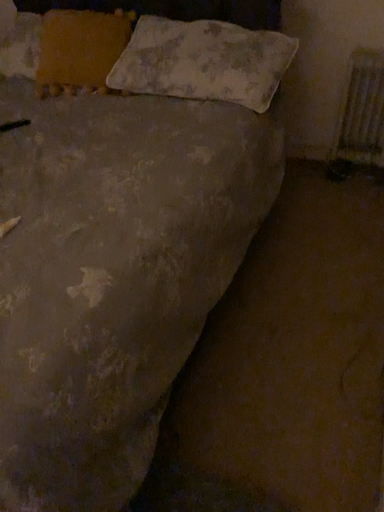
How much space does orange fabric pillow at upper left, acting as the first pillow starting from the left, occupy vertically?

The height of orange fabric pillow at upper left, acting as the first pillow starting from the left, is 26.10 centimeters.

Image resolution: width=384 pixels, height=512 pixels. What do you see at coordinates (79, 50) in the screenshot?
I see `orange fabric pillow at upper left, which ranks as the 2th pillow in right-to-left order` at bounding box center [79, 50].

The height and width of the screenshot is (512, 384). What are the coordinates of `orange fabric pillow at upper left, acting as the first pillow starting from the left` in the screenshot? It's located at (79, 50).

From a real-world perspective, who is located higher, orange fabric pillow at upper left, acting as the first pillow starting from the left, or metallic silver radiator at right?

orange fabric pillow at upper left, acting as the first pillow starting from the left, is physically above.

Which object is wider, orange fabric pillow at upper left, which ranks as the 2th pillow in right-to-left order, or metallic silver radiator at right?

With larger width is orange fabric pillow at upper left, which ranks as the 2th pillow in right-to-left order.

Is orange fabric pillow at upper left, which ranks as the 2th pillow in right-to-left order, positioned far away from metallic silver radiator at right?

Yes, orange fabric pillow at upper left, which ranks as the 2th pillow in right-to-left order, is far from metallic silver radiator at right.

Is orange fabric pillow at upper left, which ranks as the 2th pillow in right-to-left order, to the right of metallic silver radiator at right from the viewer's perspective?

No.

Which object is positioned more to the left, textured beige pillow at upper center, the 2th pillow positioned from the left, or metallic silver radiator at right?

textured beige pillow at upper center, the 2th pillow positioned from the left, is more to the left.

Where is `radiator below the textured beige pillow at upper center, the first pillow positioned from the right (from a real-world perspective)`? radiator below the textured beige pillow at upper center, the first pillow positioned from the right (from a real-world perspective) is located at coordinates (361, 110).

Who is more distant, textured beige pillow at upper center, the 2th pillow positioned from the left, or metallic silver radiator at right?

metallic silver radiator at right is behind.

Is textured beige pillow at upper center, the 2th pillow positioned from the left, oriented away from metallic silver radiator at right?

No, metallic silver radiator at right is not at the back of textured beige pillow at upper center, the 2th pillow positioned from the left.

Considering the positions of objects orange fabric pillow at upper left, acting as the first pillow starting from the left, and textured beige pillow at upper center, the 2th pillow positioned from the left, in the image provided, who is in front, orange fabric pillow at upper left, acting as the first pillow starting from the left, or textured beige pillow at upper center, the 2th pillow positioned from the left,?

textured beige pillow at upper center, the 2th pillow positioned from the left, is more forward.

Visually, is orange fabric pillow at upper left, acting as the first pillow starting from the left, positioned to the left or to the right of textured beige pillow at upper center, the 2th pillow positioned from the left?

Clearly, orange fabric pillow at upper left, acting as the first pillow starting from the left, is on the left of textured beige pillow at upper center, the 2th pillow positioned from the left, in the image.

Which is farther, (48, 19) or (238, 29)?

Positioned behind is point (48, 19).

Based on the photo, considering their positions, is metallic silver radiator at right located in front of or behind orange fabric pillow at upper left, acting as the first pillow starting from the left?

Clearly, metallic silver radiator at right is behind orange fabric pillow at upper left, acting as the first pillow starting from the left.

What's the angular difference between metallic silver radiator at right and orange fabric pillow at upper left, acting as the first pillow starting from the left,'s facing directions?

0.965 degrees separate the facing orientations of metallic silver radiator at right and orange fabric pillow at upper left, acting as the first pillow starting from the left.

From the image's perspective, which is below, metallic silver radiator at right or orange fabric pillow at upper left, acting as the first pillow starting from the left?

From the image's view, metallic silver radiator at right is below.

Is metallic silver radiator at right facing away from orange fabric pillow at upper left, acting as the first pillow starting from the left?

No, metallic silver radiator at right is not facing the opposite direction of orange fabric pillow at upper left, acting as the first pillow starting from the left.

From the image's perspective, is metallic silver radiator at right above or below textured beige pillow at upper center, the 2th pillow positioned from the left?

metallic silver radiator at right is below textured beige pillow at upper center, the 2th pillow positioned from the left.

Is textured beige pillow at upper center, the 2th pillow positioned from the left, completely or partially inside metallic silver radiator at right?

Definitely not — textured beige pillow at upper center, the 2th pillow positioned from the left, is not inside metallic silver radiator at right.

This screenshot has height=512, width=384. I want to click on radiator behind the textured beige pillow at upper center, the 2th pillow positioned from the left, so click(x=361, y=110).

Could you tell me if metallic silver radiator at right is turned towards textured beige pillow at upper center, the 2th pillow positioned from the left?

No.

In the scene shown: Is textured beige pillow at upper center, the 2th pillow positioned from the left, directly adjacent to orange fabric pillow at upper left, acting as the first pillow starting from the left?

No, textured beige pillow at upper center, the 2th pillow positioned from the left, is not touching orange fabric pillow at upper left, acting as the first pillow starting from the left.

From the image's perspective, which is above, textured beige pillow at upper center, the first pillow positioned from the right, or orange fabric pillow at upper left, which ranks as the 2th pillow in right-to-left order?

From the image's view, orange fabric pillow at upper left, which ranks as the 2th pillow in right-to-left order, is above.

Which of these two, textured beige pillow at upper center, the first pillow positioned from the right, or orange fabric pillow at upper left, acting as the first pillow starting from the left, is smaller?

orange fabric pillow at upper left, acting as the first pillow starting from the left.

At what (x,y) coordinates should I click in order to perform the action: click on pillow that is the 1st one when counting forward from the metallic silver radiator at right. Please return your answer as a coordinate pair (x, y). Looking at the image, I should click on (79, 50).

From the metallic silver radiator at right, count the 1st pillow to the left and point to it. Please provide its 2D coordinates.

[(203, 62)]

Considering their positions, is metallic silver radiator at right positioned further to orange fabric pillow at upper left, which ranks as the 2th pillow in right-to-left order, than textured beige pillow at upper center, the 2th pillow positioned from the left?

metallic silver radiator at right.

From the image, which object appears to be nearer to textured beige pillow at upper center, the first pillow positioned from the right, metallic silver radiator at right or orange fabric pillow at upper left, acting as the first pillow starting from the left?

orange fabric pillow at upper left, acting as the first pillow starting from the left, is closer to textured beige pillow at upper center, the first pillow positioned from the right.

From the image, which object appears to be nearer to textured beige pillow at upper center, the 2th pillow positioned from the left, orange fabric pillow at upper left, which ranks as the 2th pillow in right-to-left order, or metallic silver radiator at right?

The object closer to textured beige pillow at upper center, the 2th pillow positioned from the left, is orange fabric pillow at upper left, which ranks as the 2th pillow in right-to-left order.

Estimate the real-world distances between objects in this image. Which object is further from orange fabric pillow at upper left, acting as the first pillow starting from the left, textured beige pillow at upper center, the 2th pillow positioned from the left, or metallic silver radiator at right?

metallic silver radiator at right is positioned further to the anchor orange fabric pillow at upper left, acting as the first pillow starting from the left.

Based on their spatial positions, is textured beige pillow at upper center, the 2th pillow positioned from the left, or orange fabric pillow at upper left, which ranks as the 2th pillow in right-to-left order, closer to metallic silver radiator at right?

The object closer to metallic silver radiator at right is textured beige pillow at upper center, the 2th pillow positioned from the left.

Considering their positions, is orange fabric pillow at upper left, which ranks as the 2th pillow in right-to-left order, positioned further to metallic silver radiator at right than textured beige pillow at upper center, the 2th pillow positioned from the left?

Among the two, orange fabric pillow at upper left, which ranks as the 2th pillow in right-to-left order, is located further to metallic silver radiator at right.

This screenshot has width=384, height=512. What are the coordinates of `pillow located between orange fabric pillow at upper left, acting as the first pillow starting from the left, and metallic silver radiator at right in the left-right direction` in the screenshot? It's located at tap(203, 62).